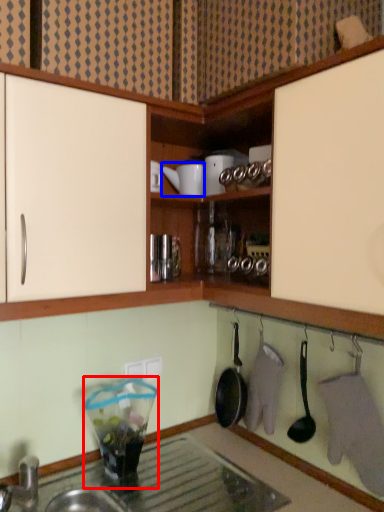
Question: Which object appears farthest to the camera in this image, appliance (highlighted by a red box) or appliance (highlighted by a blue box)?

Choices:
 (A) appliance
 (B) appliance

Answer: (B)